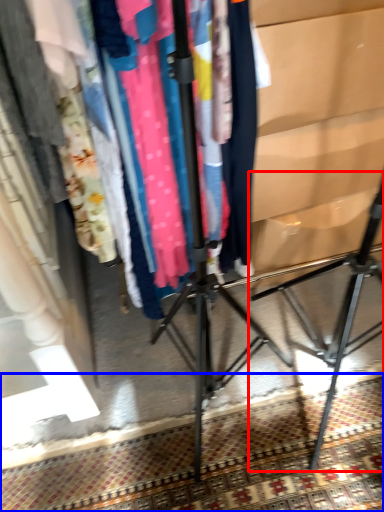
Question: Among these objects, which one is nearest to the camera, tripod (highlighted by a red box) or mat (highlighted by a blue box)?

Choices:
 (A) tripod
 (B) mat

Answer: (A)